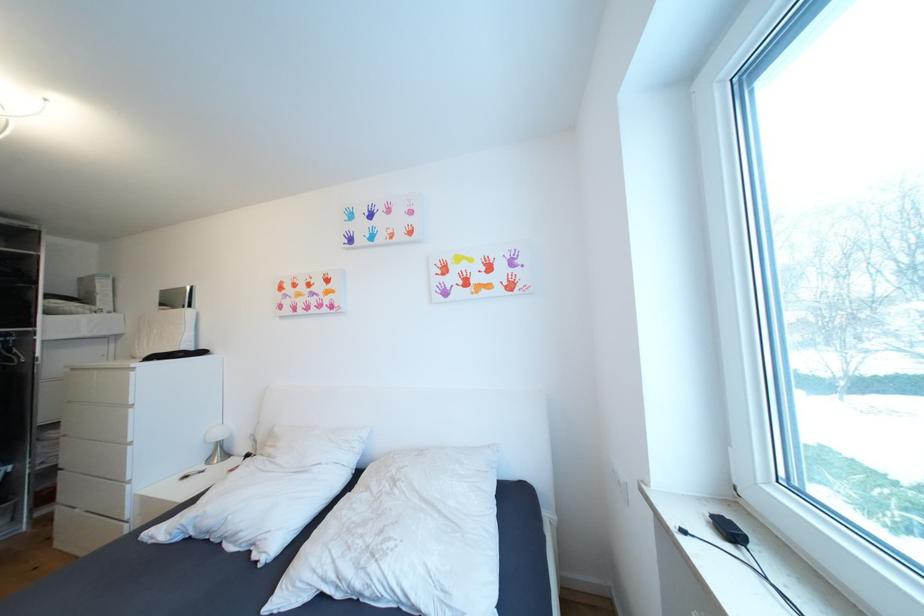
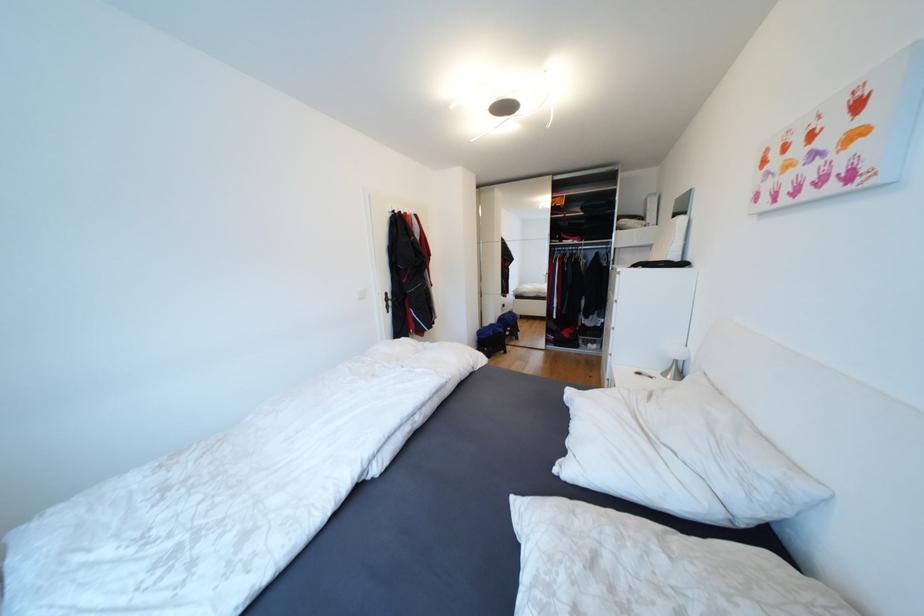
Find the pixel in the second image that matches pixel 225 436 in the first image.

(682, 354)